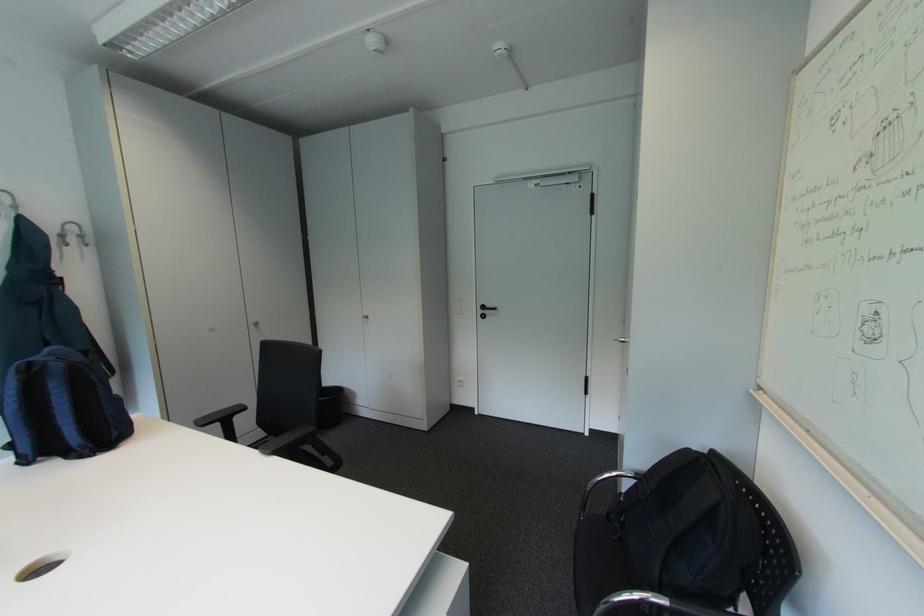
Where would you placing arm the chrome chair armrest? Please return your answer as a coordinate pair (x, y).

(611, 477)